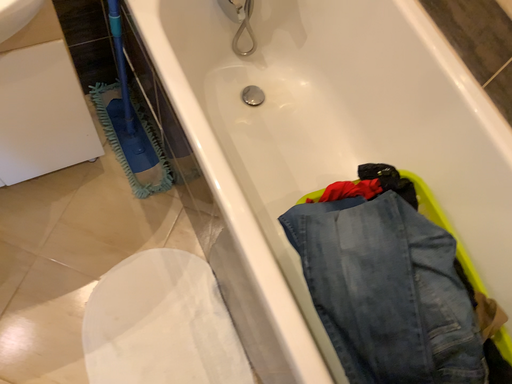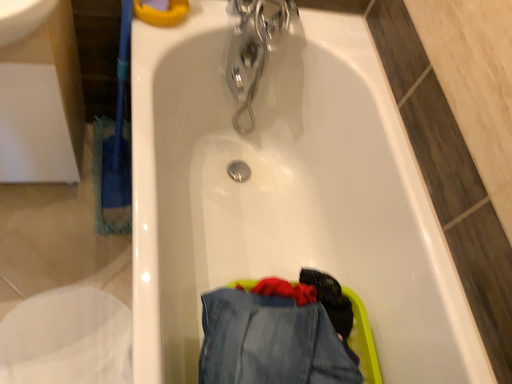
Question: How did the camera likely rotate when shooting the video?

Choices:
 (A) rotated downward
 (B) rotated upward

Answer: (B)